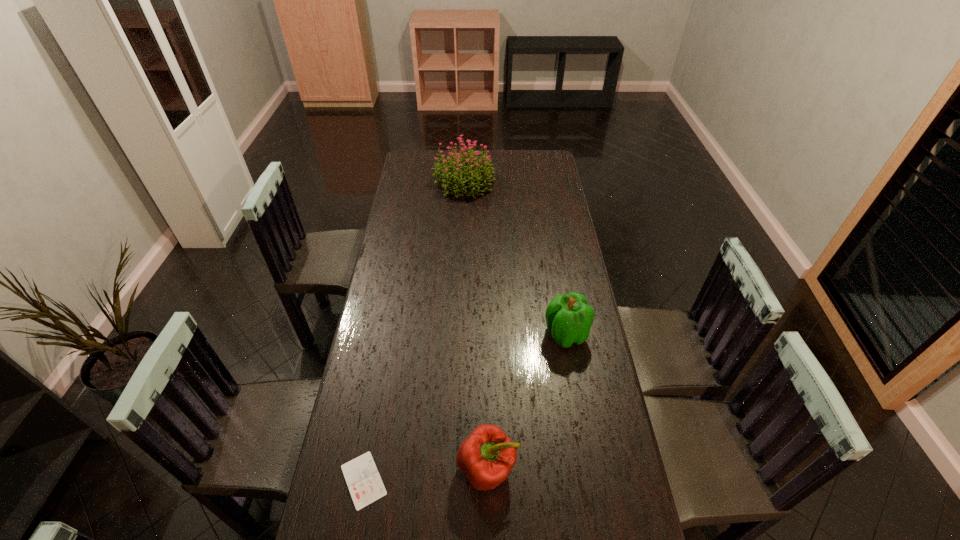
You are a GUI agent. You are given a task and a screenshot of the screen. Output one action in this format:
    pyautogui.click(x=<x>, y=<y>)
    Task: Click on the free space that is in between the farthest object and the taller bell pepper
    Image resolution: width=960 pixels, height=540 pixels.
    Given the screenshot: What is the action you would take?
    pyautogui.click(x=515, y=259)

Locate an element on the screen. The width and height of the screenshot is (960, 540). free space between the tallest object and the rightmost object is located at coordinates (515, 259).

You are a GUI agent. You are given a task and a screenshot of the screen. Output one action in this format:
    pyautogui.click(x=<x>, y=<y>)
    Task: Click on the vacant space that's between the third shortest object and the diary
    This screenshot has width=960, height=540.
    Given the screenshot: What is the action you would take?
    pyautogui.click(x=465, y=407)

You are a GUI agent. You are given a task and a screenshot of the screen. Output one action in this format:
    pyautogui.click(x=<x>, y=<y>)
    Task: Click on the unoccupied area between the bouquet and the taller bell pepper
    The width and height of the screenshot is (960, 540).
    Given the screenshot: What is the action you would take?
    pyautogui.click(x=515, y=259)

The width and height of the screenshot is (960, 540). Find the location of `free spot between the third tallest object and the second farthest object`. free spot between the third tallest object and the second farthest object is located at coordinates (527, 401).

Locate an element on the screen. This screenshot has height=540, width=960. blank region between the leftmost object and the rightmost object is located at coordinates (465, 407).

The image size is (960, 540). I want to click on empty location between the right bell pepper and the shortest object, so click(x=465, y=407).

The width and height of the screenshot is (960, 540). What are the coordinates of `free space between the leftmost object and the third nearest object` in the screenshot? It's located at (465, 407).

Identify the location of free spot between the nearer bell pepper and the third nearest object. (527, 401).

At what (x,y) coordinates should I click in order to perform the action: click on free space between the shortest object and the farthest object. Please return your answer as a coordinate pair (x, y). Image resolution: width=960 pixels, height=540 pixels. Looking at the image, I should click on (414, 332).